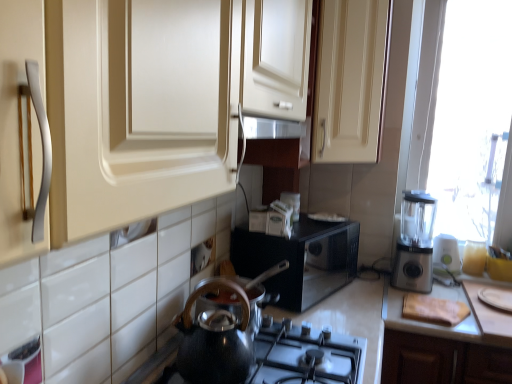
Question: Is black glossy microwave at center, the 3th appliance when ordered from right to left, positioned before matte cream cabinet at upper center?

Choices:
 (A) yes
 (B) no

Answer: (B)

Question: Does black glossy microwave at center, the 1th appliance from the left, appear on the left side of matte cream cabinet at upper center?

Choices:
 (A) yes
 (B) no

Answer: (A)

Question: Can you confirm if black glossy microwave at center, the 3th appliance when ordered from right to left, is smaller than matte cream cabinet at upper center?

Choices:
 (A) no
 (B) yes

Answer: (B)

Question: Is matte cream cabinet at upper center completely or partially inside black glossy microwave at center, the 1th appliance from the left?

Choices:
 (A) no
 (B) yes

Answer: (A)

Question: Is black glossy microwave at center, the 1th appliance from the left, shorter than matte cream cabinet at upper center?

Choices:
 (A) no
 (B) yes

Answer: (B)

Question: Is point (437, 235) closer or farther from the camera than point (300, 347)?

Choices:
 (A) farther
 (B) closer

Answer: (A)

Question: In terms of size, does white plastic blender at right, which is counted as the second appliance, starting from the left, appear bigger or smaller than shiny black kettle at lower center?

Choices:
 (A) small
 (B) big

Answer: (A)

Question: From their relative heights in the image, would you say white plastic blender at right, which is counted as the second appliance, starting from the left, is taller or shorter than shiny black kettle at lower center?

Choices:
 (A) short
 (B) tall

Answer: (B)

Question: Considering the relative positions of white plastic blender at right, which is counted as the second appliance, starting from the left, and shiny black kettle at lower center in the image provided, is white plastic blender at right, which is counted as the second appliance, starting from the left, to the left or to the right of shiny black kettle at lower center?

Choices:
 (A) right
 (B) left

Answer: (A)

Question: In terms of width, does white plastic plate at lower right, acting as the 1th appliance starting from the right, look wider or thinner when compared to white matte cutting board at right?

Choices:
 (A) wide
 (B) thin

Answer: (B)

Question: From the image's perspective, is white plastic plate at lower right, acting as the 1th appliance starting from the right, above or below white matte cutting board at right?

Choices:
 (A) below
 (B) above

Answer: (B)

Question: Considering the relative positions of white plastic plate at lower right, which appears as the 3th appliance when viewed from the left, and white matte cutting board at right in the image provided, is white plastic plate at lower right, which appears as the 3th appliance when viewed from the left, to the left or to the right of white matte cutting board at right?

Choices:
 (A) right
 (B) left

Answer: (A)

Question: Is point (502, 301) positioned closer to the camera than point (397, 319)?

Choices:
 (A) farther
 (B) closer

Answer: (A)

Question: From a real-world perspective, is white plastic blender at right, the second appliance from the right, physically located above or below white plastic plate at lower right, acting as the 1th appliance starting from the right?

Choices:
 (A) above
 (B) below

Answer: (A)

Question: Considering the positions of white plastic blender at right, which is counted as the second appliance, starting from the left, and white plastic plate at lower right, which appears as the 3th appliance when viewed from the left, in the image, is white plastic blender at right, which is counted as the second appliance, starting from the left, wider or thinner than white plastic plate at lower right, which appears as the 3th appliance when viewed from the left,?

Choices:
 (A) wide
 (B) thin

Answer: (B)